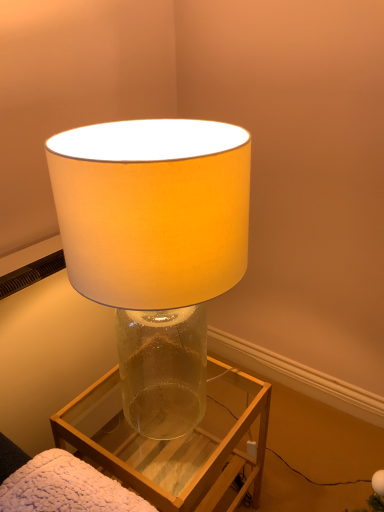
Question: Should I look upward or downward to see translucent glass lamp at center?

Choices:
 (A) down
 (B) up

Answer: (A)

Question: Does transparent glass vase at center turn towards translucent glass lamp at center?

Choices:
 (A) yes
 (B) no

Answer: (B)

Question: Is transparent glass vase at center next to translucent glass lamp at center?

Choices:
 (A) yes
 (B) no

Answer: (B)

Question: Is transparent glass vase at center far from translucent glass lamp at center?

Choices:
 (A) no
 (B) yes

Answer: (A)

Question: Can you confirm if transparent glass vase at center is shorter than translucent glass lamp at center?

Choices:
 (A) yes
 (B) no

Answer: (A)

Question: Is transparent glass vase at center turned away from translucent glass lamp at center?

Choices:
 (A) yes
 (B) no

Answer: (B)

Question: Can you confirm if transparent glass vase at center is thinner than translucent glass lamp at center?

Choices:
 (A) no
 (B) yes

Answer: (A)

Question: Can you confirm if translucent glass lamp at center is smaller than transparent glass vase at center?

Choices:
 (A) no
 (B) yes

Answer: (A)

Question: Is translucent glass lamp at center bigger than transparent glass vase at center?

Choices:
 (A) no
 (B) yes

Answer: (B)

Question: From the image's perspective, does translucent glass lamp at center appear lower than transparent glass vase at center?

Choices:
 (A) no
 (B) yes

Answer: (A)

Question: Is translucent glass lamp at center outside of transparent glass vase at center?

Choices:
 (A) yes
 (B) no

Answer: (A)

Question: Considering the relative positions of translucent glass lamp at center and transparent glass vase at center in the image provided, is translucent glass lamp at center to the right of transparent glass vase at center from the viewer's perspective?

Choices:
 (A) yes
 (B) no

Answer: (B)

Question: Is translucent glass lamp at center positioned before transparent glass vase at center?

Choices:
 (A) yes
 (B) no

Answer: (A)

Question: Is transparent glass vase at center situated inside translucent glass lamp at center or outside?

Choices:
 (A) inside
 (B) outside

Answer: (B)